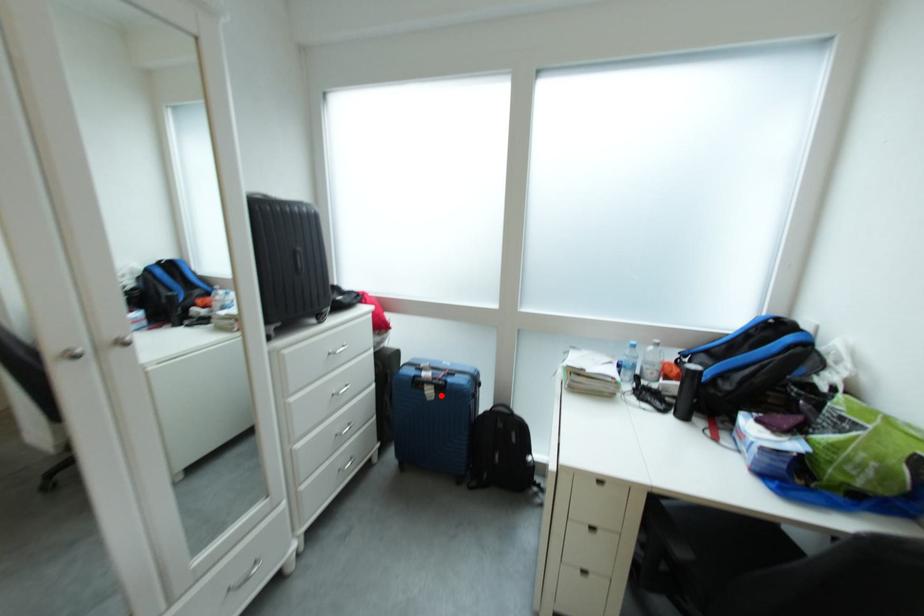
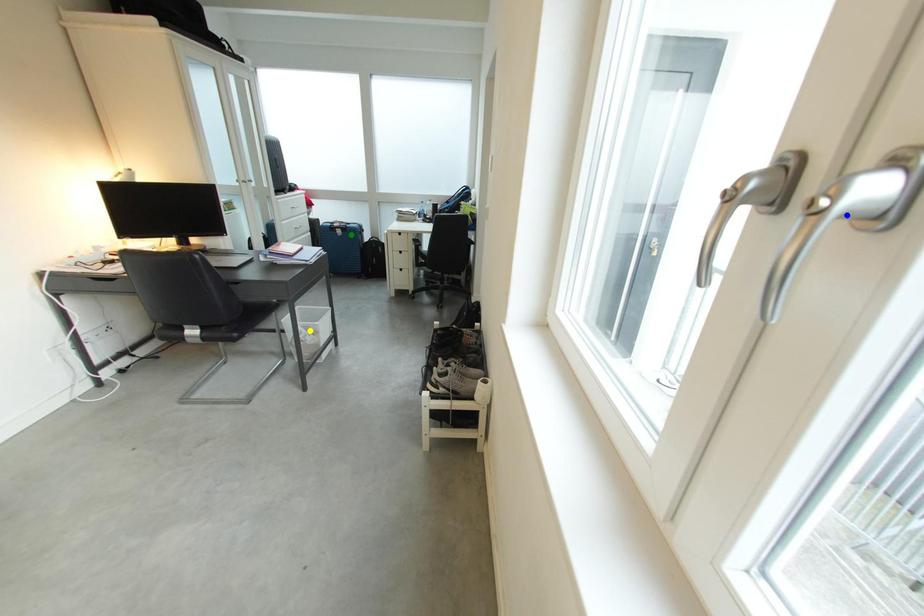
Question: I am providing you with two images of the same scene from different viewpoints. A red point is marked on the first image. You are given multiple points on the second image. Which point in image 2 represents the same 3d spot as the red point in image 1?

Choices:
 (A) yellow point
 (B) blue point
 (C) green point

Answer: (C)